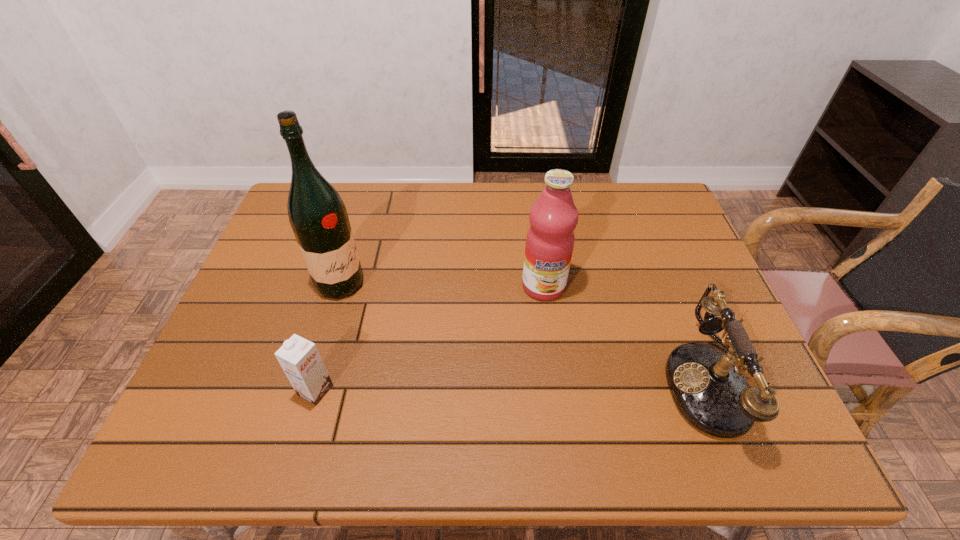
You are a GUI agent. You are given a task and a screenshot of the screen. Output one action in this format:
    pyautogui.click(x=<x>, y=<y>)
    Task: Click on the free space between the chocolate milk and the third tallest object
    Image resolution: width=960 pixels, height=540 pixels.
    Given the screenshot: What is the action you would take?
    pyautogui.click(x=516, y=387)

This screenshot has width=960, height=540. Identify the location of free space that is in between the chocolate milk and the third shortest object. (429, 338).

This screenshot has height=540, width=960. What are the coordinates of `vacant area that lies between the liquor and the shortest object` in the screenshot? It's located at (328, 337).

Find the location of a particular element. The width and height of the screenshot is (960, 540). empty space that is in between the third tallest object and the third shortest object is located at coordinates (630, 334).

Identify the location of vacant space that's between the fruit juice and the tallest object. (442, 285).

Locate which object is the third closest to the tallest object. Please provide its 2D coordinates. Your answer should be formatted as a tuple, i.e. [(x, y)], where the tuple contains the x and y coordinates of a point satisfying the conditions above.

[(709, 389)]

Where is `object that can be found as the closest to the tallest object`? This screenshot has width=960, height=540. object that can be found as the closest to the tallest object is located at coordinates (299, 358).

Where is `free space in the image that satisfies the following two spatial constraints: 1. on the front side of the telephone; 2. on the dial of the tallest object`? free space in the image that satisfies the following two spatial constraints: 1. on the front side of the telephone; 2. on the dial of the tallest object is located at coordinates (311, 383).

Locate an element on the screen. Image resolution: width=960 pixels, height=540 pixels. vacant space that satisfies the following two spatial constraints: 1. on the front side of the rightmost object; 2. on the dial of the tallest object is located at coordinates (311, 383).